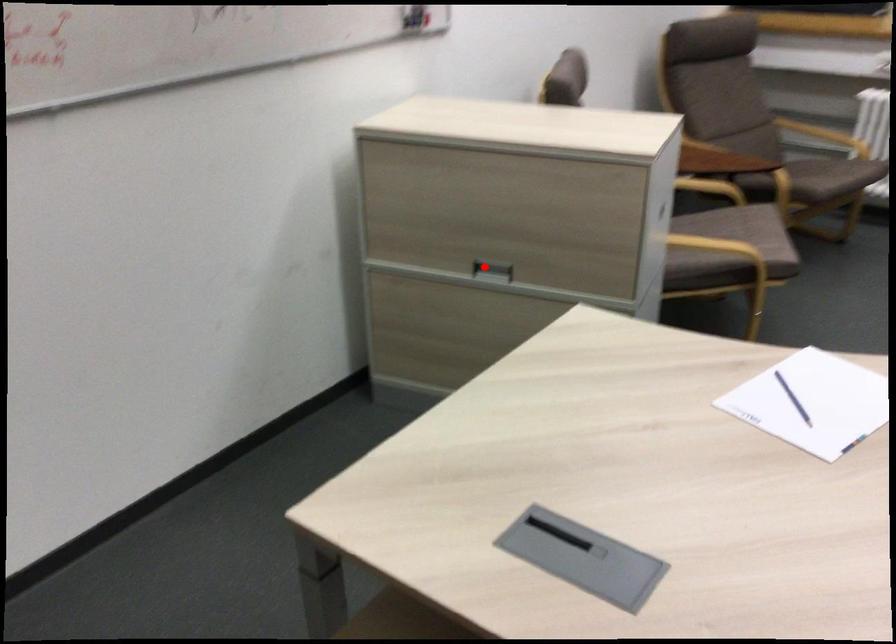
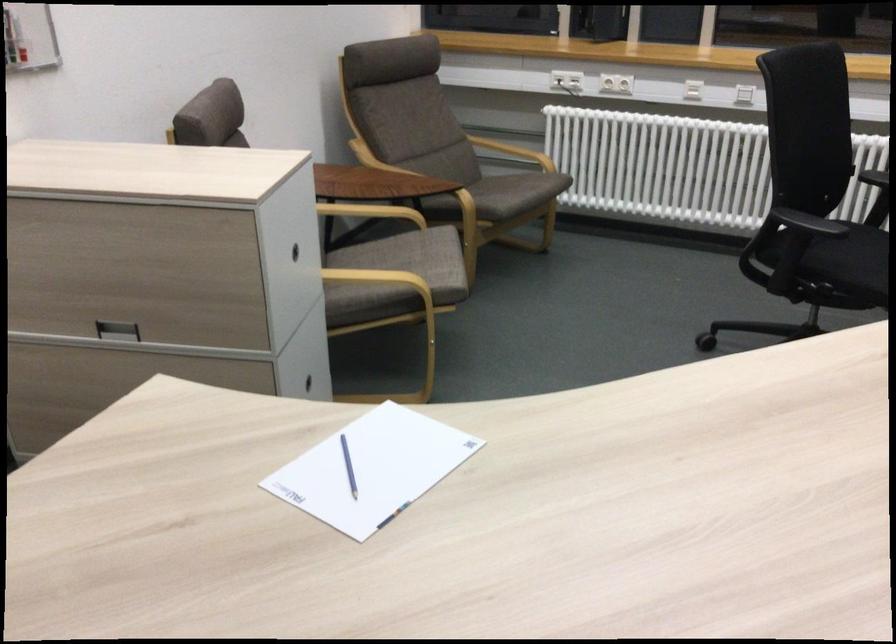
Find the pixel in the second image that matches the highlighted location in the first image.

(116, 330)